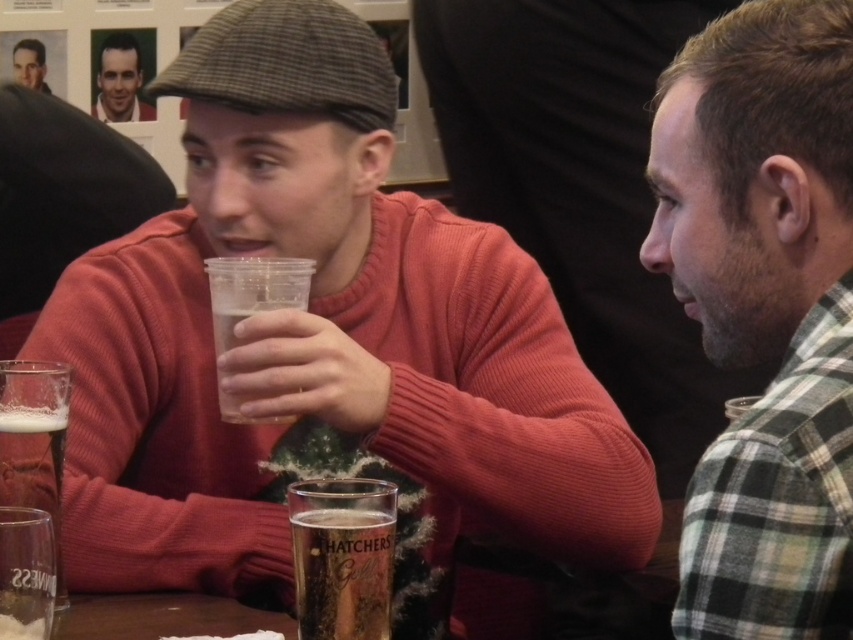
Question: Among these objects, which one is nearest to the camera?

Choices:
 (A) clear glass at left
 (B) translucent plastic cup at center
 (C) translucent glass at center

Answer: (C)

Question: Which object is positioned closest to the flannel shirt at right?

Choices:
 (A) translucent glass at center
 (B) clear glass at lower left
 (C) translucent plastic cup at center

Answer: (A)

Question: Does flannel shirt at right have a greater width compared to smooth skin face at upper left?

Choices:
 (A) no
 (B) yes

Answer: (B)

Question: Is translucent plastic cup at center bigger than clear glass at lower left?

Choices:
 (A) yes
 (B) no

Answer: (A)

Question: Can you confirm if clear glass at left is positioned to the left of smooth skin face at upper left?

Choices:
 (A) no
 (B) yes

Answer: (A)

Question: Which of the following is the farthest from the observer?

Choices:
 (A) clear glass at left
 (B) translucent plastic cup at center
 (C) flannel shirt at right
 (D) translucent glass at center

Answer: (B)